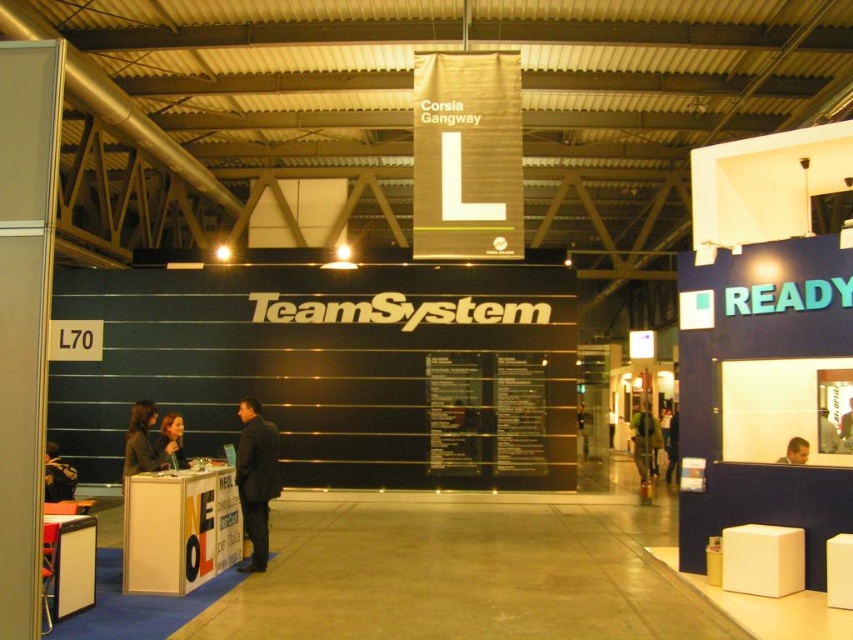
Question: Is black suit at center thinner than light brown hair at center?

Choices:
 (A) yes
 (B) no

Answer: (B)

Question: Does black suit at center have a greater width compared to dark brown leather jacket at left?

Choices:
 (A) yes
 (B) no

Answer: (A)

Question: Considering the real-world distances, which object is farthest from the black suit at center?

Choices:
 (A) green fabric jacket at center
 (B) matte black jacket at center
 (C) dark brown leather jacket at left
 (D) dark brown leather jacket at center

Answer: (A)

Question: Is black suit at center below dark brown leather jacket at center?

Choices:
 (A) no
 (B) yes

Answer: (B)

Question: Which object is positioned farthest from the dark brown leather jacket at left?

Choices:
 (A) black suit at center
 (B) dark brown leather jacket at center

Answer: (A)

Question: Which point is farther from the camera taking this photo?

Choices:
 (A) (125, 435)
 (B) (648, 417)

Answer: (B)